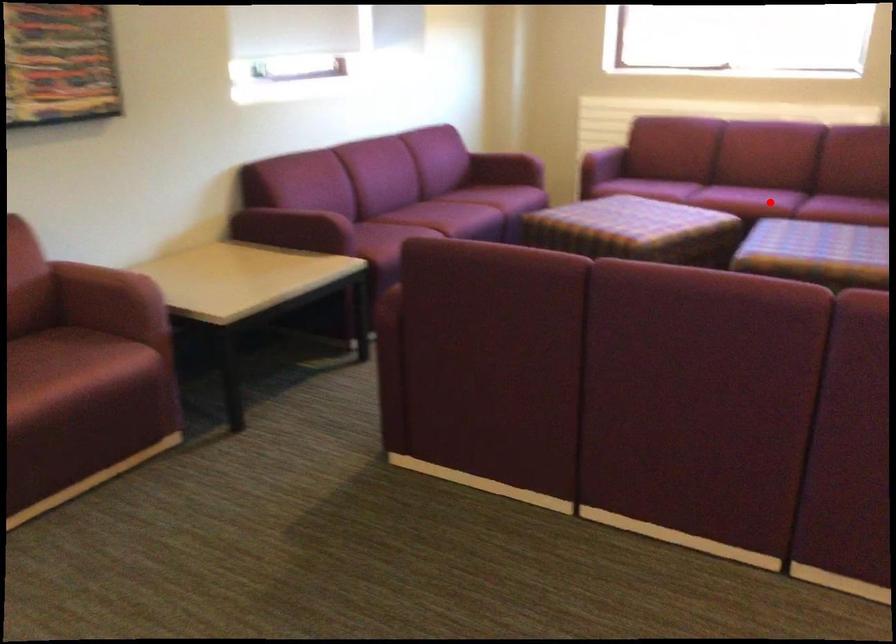
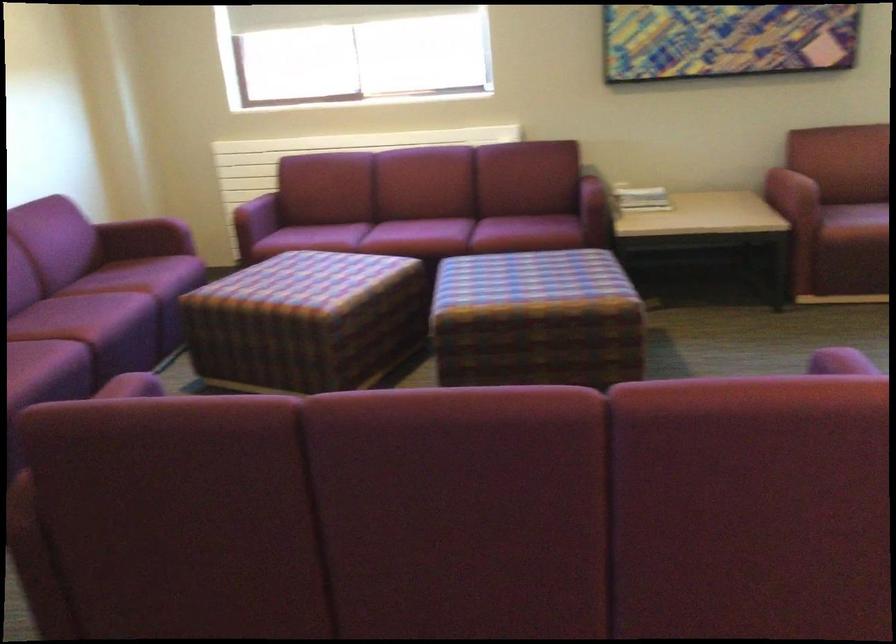
Where in the second image is the point corresponding to the highlighted location from the first image?

(445, 236)